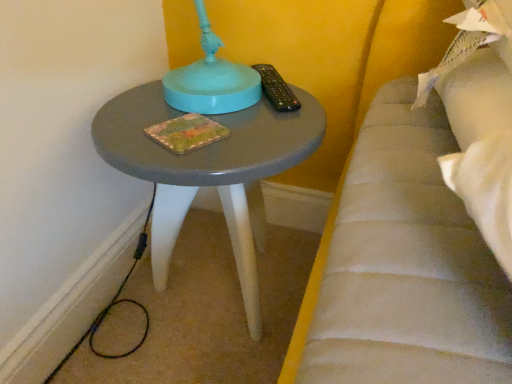
Where is `vacant space that is to the left of black plastic remote at upper right`? The height and width of the screenshot is (384, 512). vacant space that is to the left of black plastic remote at upper right is located at coordinates (168, 104).